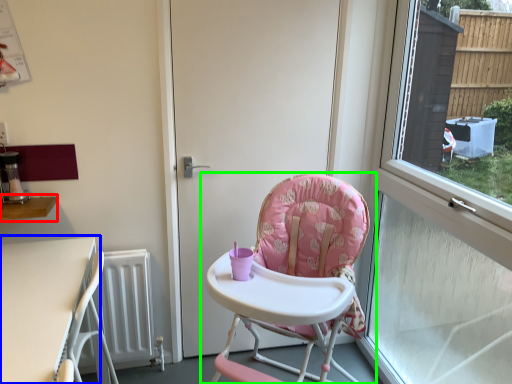
Question: Which object is the closest to the table (highlighted by a red box)? Choose among these: table (highlighted by a blue box) or chair (highlighted by a green box).

Choices:
 (A) table
 (B) chair

Answer: (A)